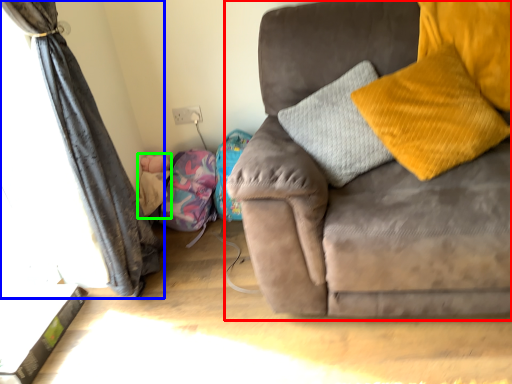
Question: Which is farther away from studio couch (highlighted by a red box)? curtain (highlighted by a blue box) or baby (highlighted by a green box)?

Choices:
 (A) curtain
 (B) baby

Answer: (B)